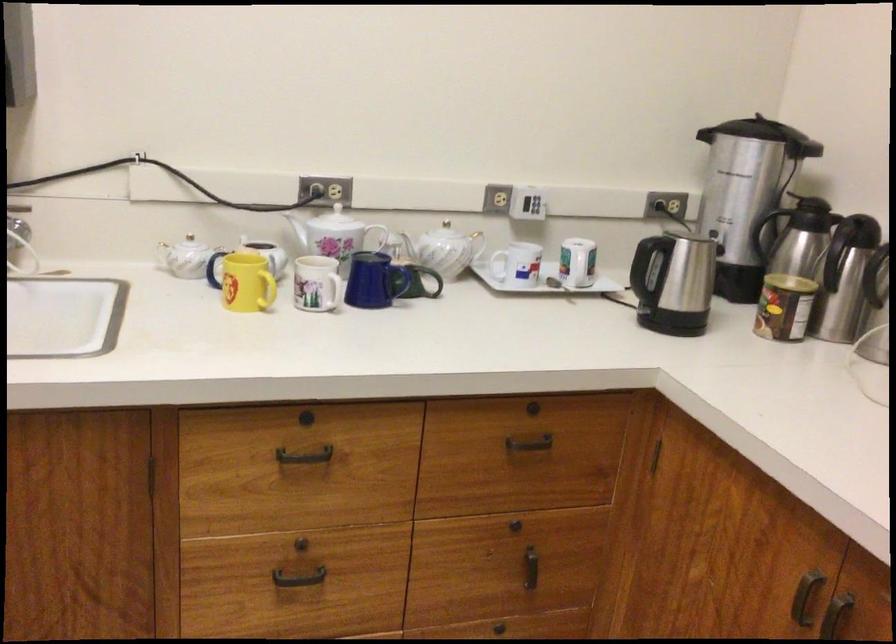
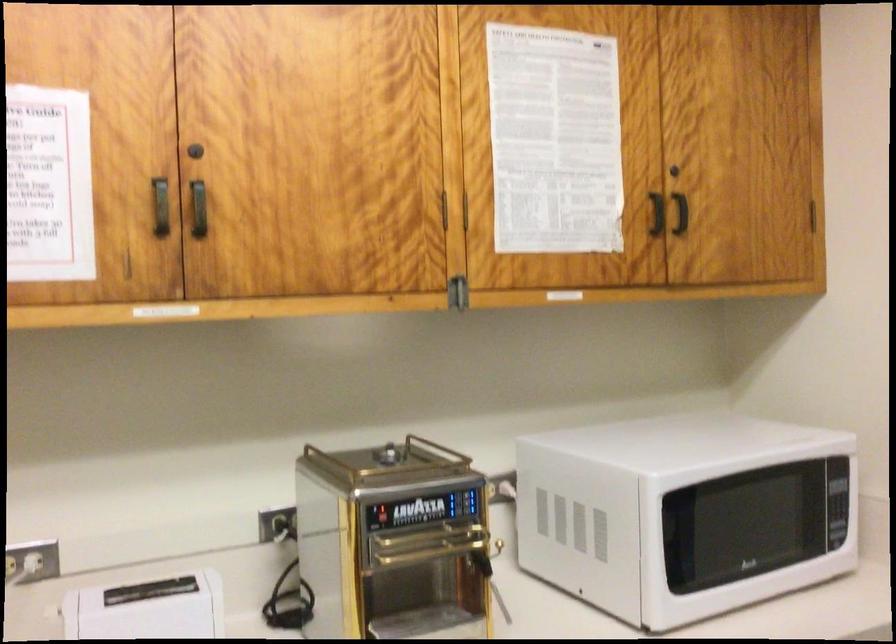
Question: Based on the continuous images, in which direction is the camera rotating? Reply with the corresponding letter.

Choices:
 (A) Left
 (B) Right
 (C) Up
 (D) Down

Answer: (B)